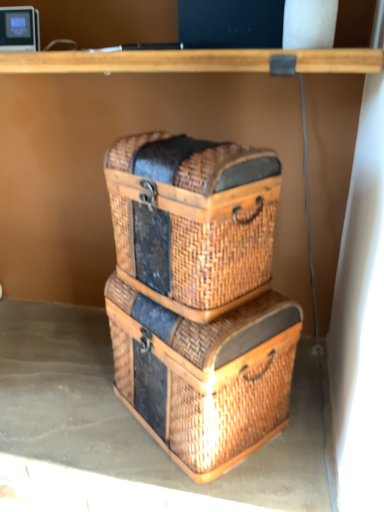
Identify the location of free location to the left of woven brown crate at center. (77, 404).